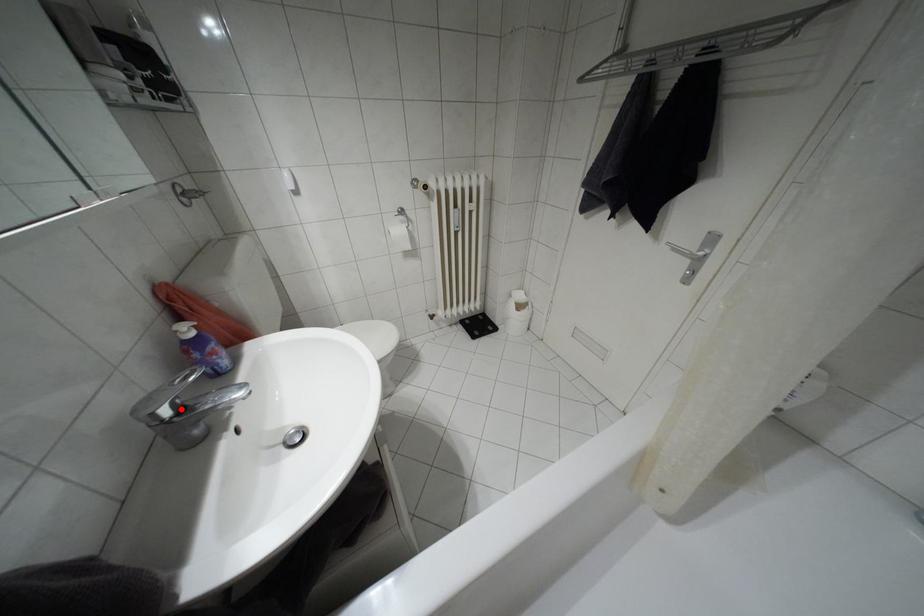
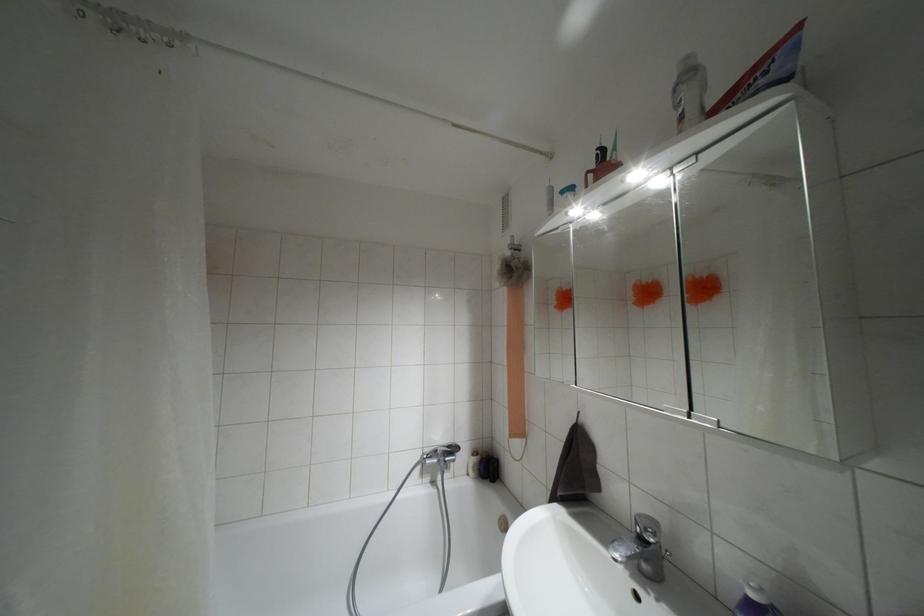
The point at the highlighted location is marked in the first image. Where is the corresponding point in the second image?

(641, 538)